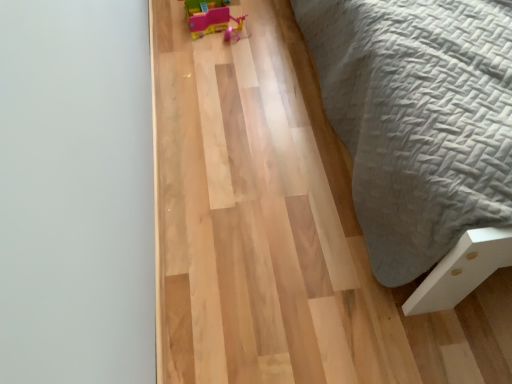
I want to click on free point in front of pink plastic toy at upper center, so click(x=215, y=63).